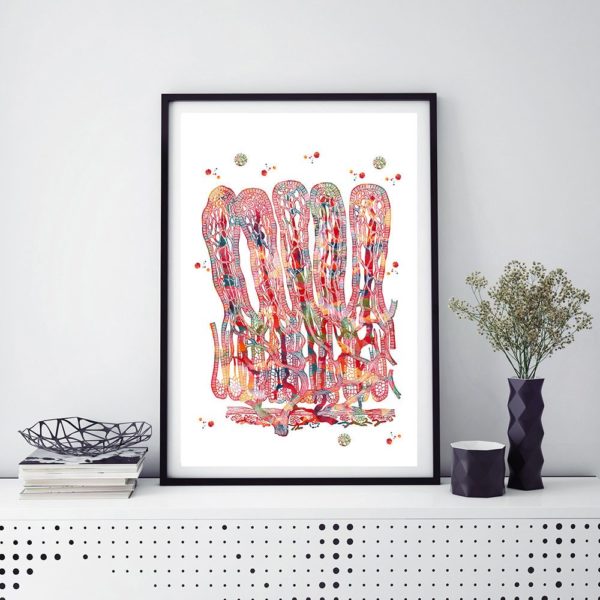
Image resolution: width=600 pixels, height=600 pixels. Find the location of `books`. books is located at coordinates (82, 472), (84, 481), (107, 492).